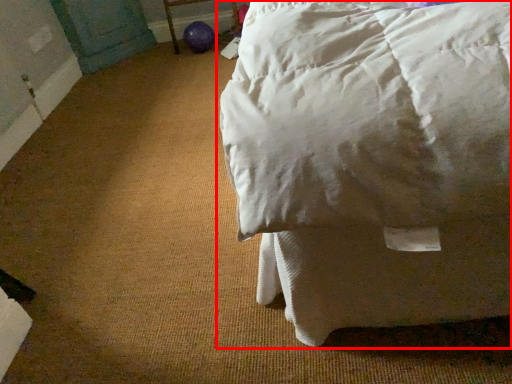
Question: From the image's perspective, what is the correct spatial relationship of bed (annotated by the red box) in relation to furniture?

Choices:
 (A) above
 (B) below

Answer: (B)